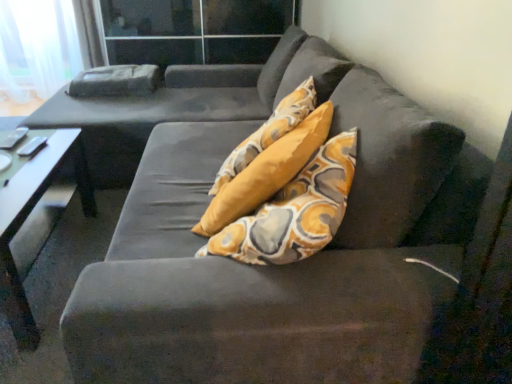
What do you see at coordinates (194, 30) in the screenshot? I see `transparent glass door at upper center` at bounding box center [194, 30].

Locate an element on the screen. transparent glass door at upper center is located at coordinates (194, 30).

In order to face smooth white table at left, should I rotate leftwards or rightwards?

Turn left approximately 31.584 degrees to face it.

What do you see at coordinates (35, 215) in the screenshot? The width and height of the screenshot is (512, 384). I see `smooth white table at left` at bounding box center [35, 215].

The height and width of the screenshot is (384, 512). I want to click on smooth white table at left, so click(x=35, y=215).

Where is `transparent glass door at upper center`? Image resolution: width=512 pixels, height=384 pixels. transparent glass door at upper center is located at coordinates (194, 30).

Does transparent glass door at upper center appear on the right side of smooth white table at left?

Indeed, transparent glass door at upper center is positioned on the right side of smooth white table at left.

Between transparent glass door at upper center and smooth white table at left, which one is positioned in front?

smooth white table at left is in front.

Which point is more forward, (234, 35) or (42, 165)?

The point (42, 165) is closer to the camera.

From the image's perspective, which is below, transparent glass door at upper center or smooth white table at left?

smooth white table at left.

From a real-world perspective, is transparent glass door at upper center positioned above or below smooth white table at left?

transparent glass door at upper center is situated higher than smooth white table at left in the real world.

Can you confirm if transparent glass door at upper center is thinner than smooth white table at left?

No.

Which of these two, transparent glass door at upper center or smooth white table at left, stands shorter?

With less height is smooth white table at left.

Considering the relative sizes of transparent glass door at upper center and smooth white table at left in the image provided, is transparent glass door at upper center bigger than smooth white table at left?

Yes.

Can we say transparent glass door at upper center lies outside smooth white table at left?

Yes, transparent glass door at upper center is outside of smooth white table at left.

Can you see transparent glass door at upper center touching smooth white table at left?

transparent glass door at upper center and smooth white table at left are clearly separated.

Is transparent glass door at upper center oriented away from smooth white table at left?

No.

Where is `glass door above the smooth white table at left (from a real-world perspective)`? This screenshot has width=512, height=384. glass door above the smooth white table at left (from a real-world perspective) is located at coordinates (194, 30).

Which object is positioned more to the left, smooth white table at left or transparent glass door at upper center?

Positioned to the left is smooth white table at left.

Considering the relative positions of smooth white table at left and transparent glass door at upper center in the image provided, is smooth white table at left behind transparent glass door at upper center?

No, it is in front of transparent glass door at upper center.

Considering the positions of point (34, 236) and point (197, 29), is point (34, 236) closer or farther from the camera than point (197, 29)?

Point (34, 236) is positioned closer to the camera compared to point (197, 29).

From the image's perspective, is smooth white table at left on transparent glass door at upper center?

Actually, smooth white table at left appears below transparent glass door at upper center in the image.

From the picture: From a real-world perspective, who is located lower, smooth white table at left or transparent glass door at upper center?

smooth white table at left, from a real-world perspective.

Which object is thinner, smooth white table at left or transparent glass door at upper center?

With smaller width is smooth white table at left.

Does smooth white table at left have a lesser height compared to transparent glass door at upper center?

Yes, smooth white table at left is shorter than transparent glass door at upper center.

In terms of size, does smooth white table at left appear bigger or smaller than transparent glass door at upper center?

In the image, smooth white table at left appears to be smaller than transparent glass door at upper center.

From the picture: Is transparent glass door at upper center a part of smooth white table at left?

No, smooth white table at left does not contain transparent glass door at upper center.

From the picture: Would you say smooth white table at left is a long distance from transparent glass door at upper center?

Yes, smooth white table at left is far from transparent glass door at upper center.

Is smooth white table at left aimed at transparent glass door at upper center?

No, smooth white table at left is not facing towards transparent glass door at upper center.

The image size is (512, 384). I want to click on table on the left side of transparent glass door at upper center, so click(35, 215).

The height and width of the screenshot is (384, 512). In order to click on table located in front of the transparent glass door at upper center in this screenshot , I will do click(x=35, y=215).

The width and height of the screenshot is (512, 384). I want to click on table that appears below the transparent glass door at upper center (from a real-world perspective), so click(35, 215).